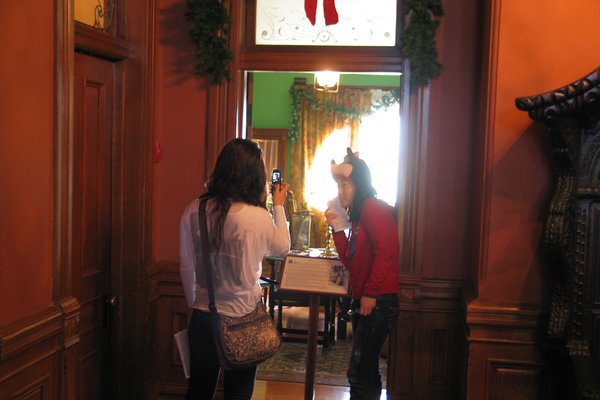
At what (x,y) coordinates should I click in order to perform the action: click on red walls. Please return your answer as a coordinate pair (x, y). The height and width of the screenshot is (400, 600). Looking at the image, I should click on (27, 212), (176, 175), (527, 51), (452, 100).